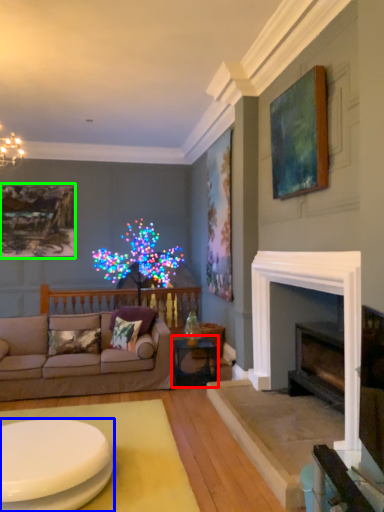
Question: Which is nearer to the table (highlighted by a red box)? coffee table (highlighted by a blue box) or picture frame (highlighted by a green box).

Choices:
 (A) coffee table
 (B) picture frame

Answer: (A)